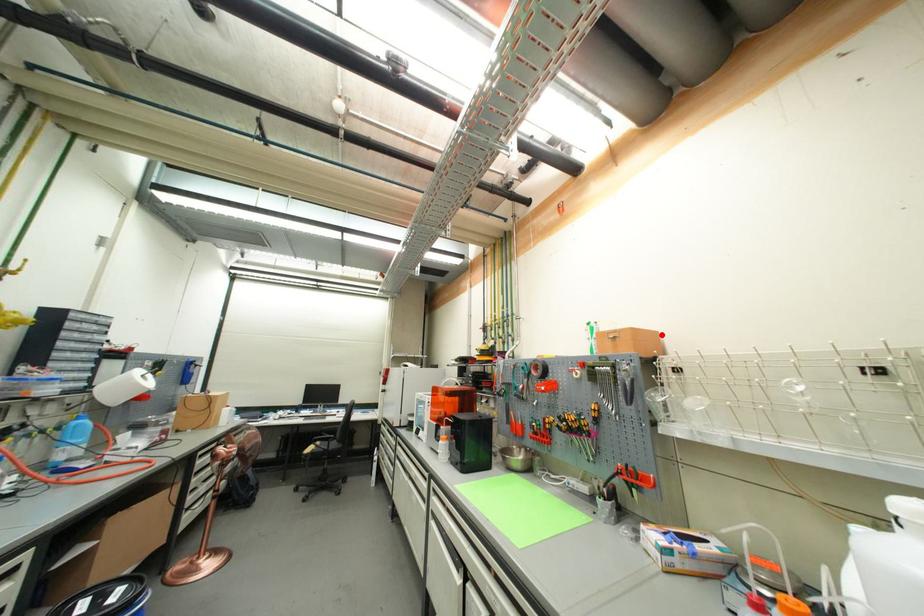
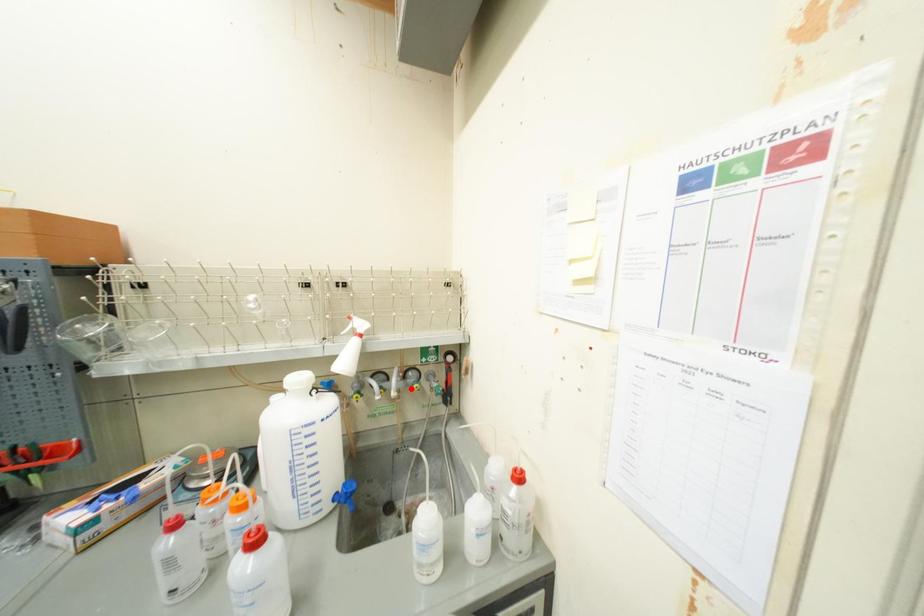
I am providing you with two images of the same scene from different viewpoints. A red point is marked on the first image and another point is marked on the second image. Is the marked point in image1 the same physical position as the marked point in image2?

No